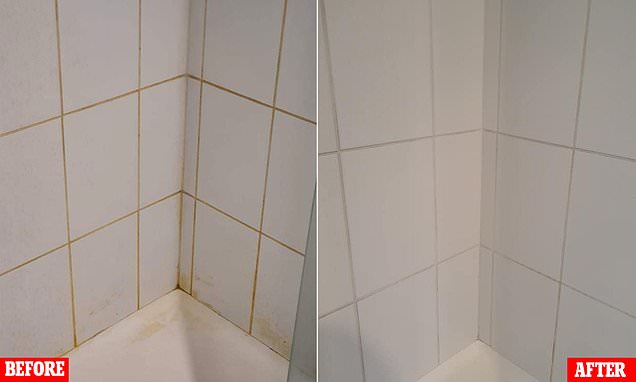
Where is `clean corner`? This screenshot has height=382, width=636. clean corner is located at coordinates (479, 333).